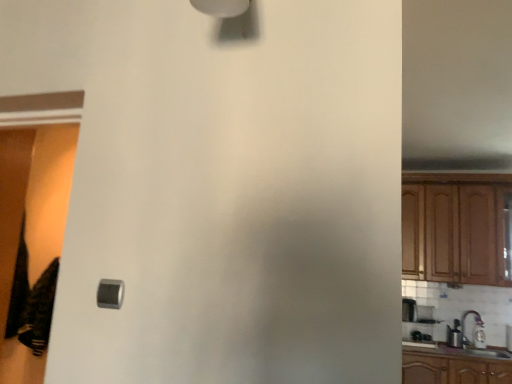
Question: From a real-world perspective, is white glossy sink at lower right under wooden cabinet at right?

Choices:
 (A) no
 (B) yes

Answer: (B)

Question: From the image's perspective, would you say white glossy sink at lower right is shown under wooden cabinet at right?

Choices:
 (A) no
 (B) yes

Answer: (B)

Question: Could wooden cabinet at right be considered to be inside white glossy sink at lower right?

Choices:
 (A) no
 (B) yes

Answer: (A)

Question: Is white glossy sink at lower right thinner than wooden cabinet at right?

Choices:
 (A) no
 (B) yes

Answer: (B)

Question: From a real-world perspective, does white glossy sink at lower right stand above wooden cabinet at right?

Choices:
 (A) no
 (B) yes

Answer: (A)

Question: Is white glossy sink at lower right positioned beyond the bounds of wooden cabinet at right?

Choices:
 (A) no
 (B) yes

Answer: (B)

Question: Does black cotton laundry at lower left have a greater height compared to metallic silver toaster at right?

Choices:
 (A) no
 (B) yes

Answer: (B)

Question: Does black cotton laundry at lower left have a greater width compared to metallic silver toaster at right?

Choices:
 (A) no
 (B) yes

Answer: (A)

Question: Is black cotton laundry at lower left not near metallic silver toaster at right?

Choices:
 (A) yes
 (B) no

Answer: (A)

Question: Can you confirm if black cotton laundry at lower left is positioned to the left of metallic silver toaster at right?

Choices:
 (A) yes
 (B) no

Answer: (A)

Question: Is black cotton laundry at lower left looking in the opposite direction of metallic silver toaster at right?

Choices:
 (A) yes
 (B) no

Answer: (B)

Question: From the image's perspective, is black cotton laundry at lower left on metallic silver toaster at right?

Choices:
 (A) no
 (B) yes

Answer: (B)

Question: Are black cotton laundry at lower left and satin silver switch at lower left making contact?

Choices:
 (A) yes
 (B) no

Answer: (B)